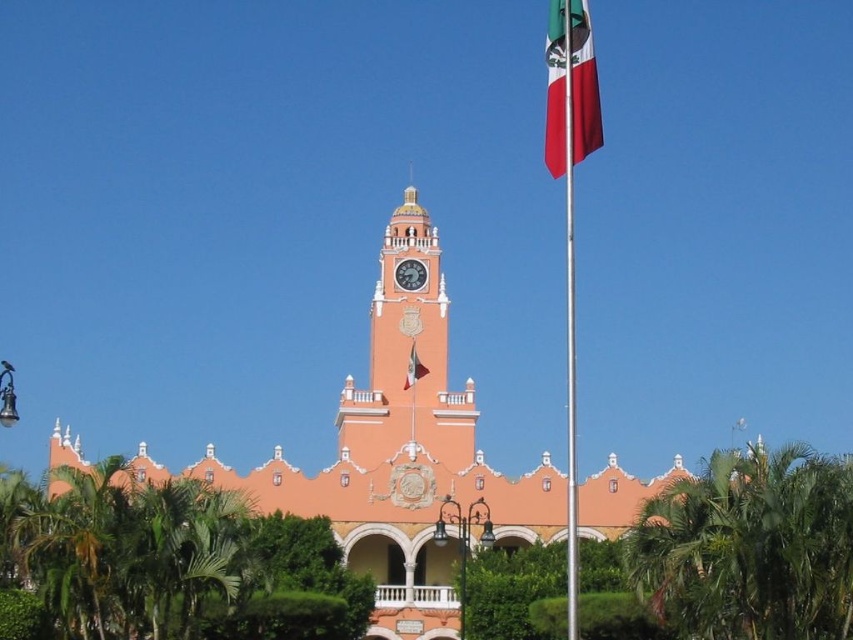
Question: Is orange stucco church at center closer to camera compared to red fabric flag at upper right?

Choices:
 (A) yes
 (B) no

Answer: (B)

Question: Which object is closer to the camera taking this photo?

Choices:
 (A) orange stucco church at center
 (B) matte orange clock at center
 (C) silky fabric flag at center

Answer: (A)

Question: Does green leafy palm tree at lower right come in front of red fabric flag at upper right?

Choices:
 (A) no
 (B) yes

Answer: (A)

Question: Based on their relative distances, which object is nearer to the orange stucco church at center?

Choices:
 (A) green leafy palm tree at lower right
 (B) silky fabric flag at center

Answer: (A)

Question: Can you confirm if orange stucco church at center is bigger than matte orange clock at center?

Choices:
 (A) yes
 (B) no

Answer: (A)

Question: Which object is positioned farthest from the silky fabric flag at center?

Choices:
 (A) orange stucco church at center
 (B) matte orange clock at center

Answer: (A)